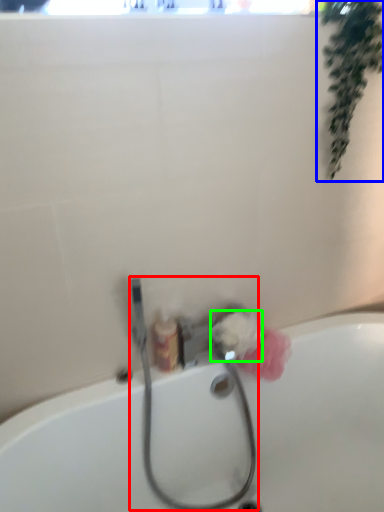
Question: Which is farther away from garden hose (highlighted by a red box)? plant (highlighted by a blue box) or flower (highlighted by a green box)?

Choices:
 (A) plant
 (B) flower

Answer: (A)